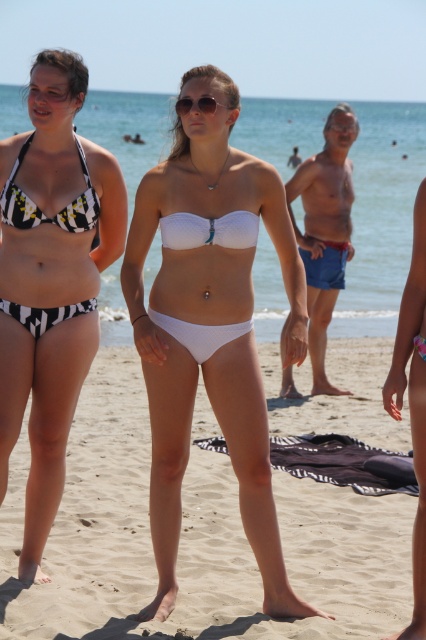
Question: Is black and white checkered bikini at left thinner than sunglasses at center?

Choices:
 (A) no
 (B) yes

Answer: (A)

Question: Which point is closer to the camera?

Choices:
 (A) black and white checkered bikini at left
 (B) white matte bikini bottom at lower right

Answer: (B)

Question: Can you confirm if white matte bikini at center is positioned above white matte bikini bottom at lower right?

Choices:
 (A) no
 (B) yes

Answer: (B)

Question: Which point is closer to the camera?

Choices:
 (A) sunglasses at center
 (B) white matte bikini bottom at lower right
 (C) white matte bikini at center

Answer: (B)

Question: Considering the real-world distances, which object is farthest from the black and white checkered bikini at left?

Choices:
 (A) black and white printed bikini at left
 (B) white matte bikini at center

Answer: (B)

Question: Can you confirm if black and white striped bikini top at left is smaller than sunglasses at center?

Choices:
 (A) yes
 (B) no

Answer: (B)